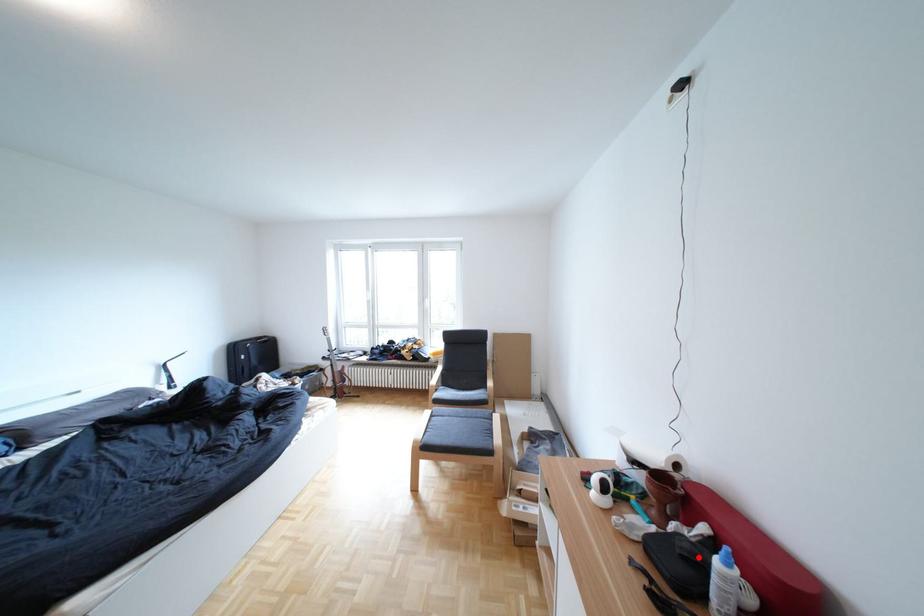
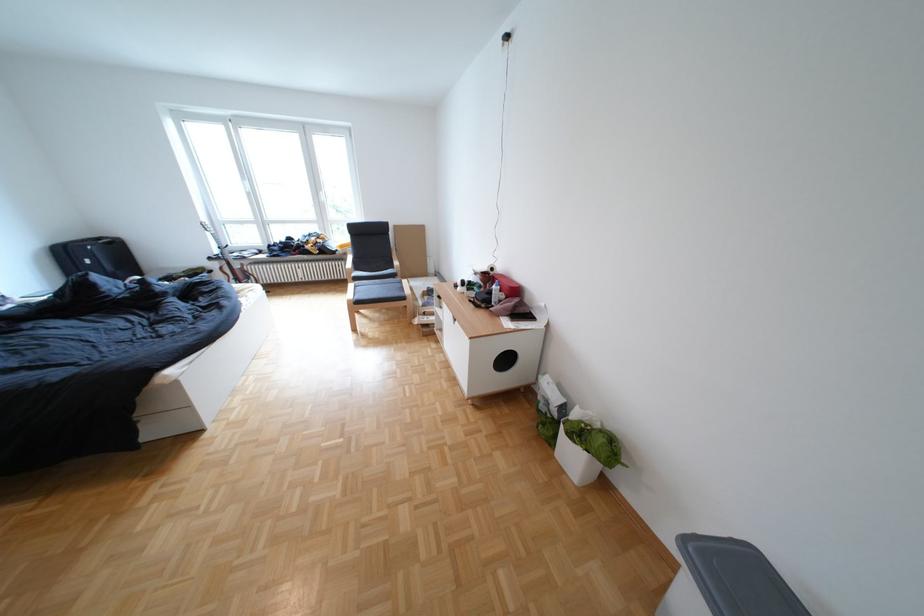
Locate, in the second image, the point that corresponds to the highlighted location in the first image.

(503, 294)